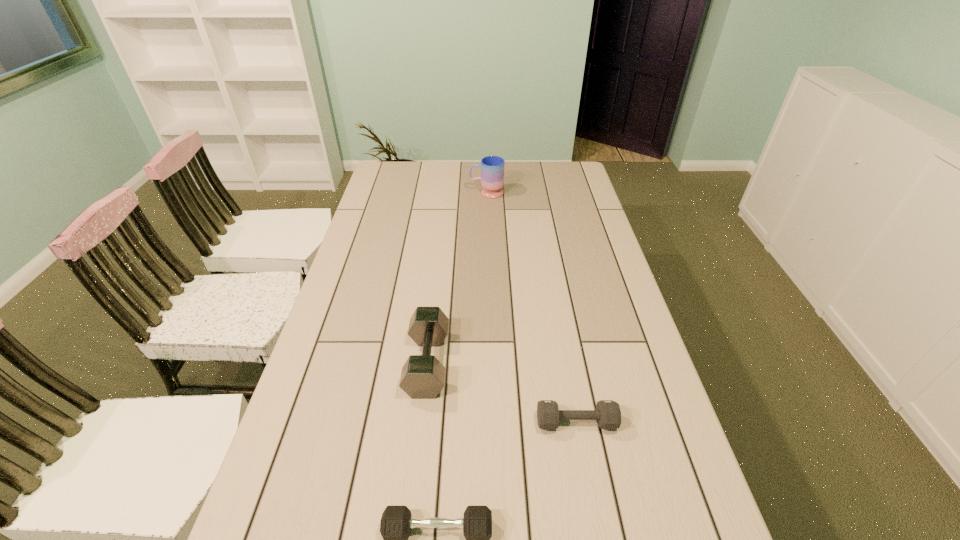
You are a GUI agent. You are given a task and a screenshot of the screen. Output one action in this format:
    pyautogui.click(x=<x>, y=<y>)
    Task: Click on the vacant region located 0.340m on the left of the second nearest dumbbell
    This screenshot has width=960, height=540.
    Given the screenshot: What is the action you would take?
    pyautogui.click(x=392, y=422)

Where is `object that is at the far edge`? object that is at the far edge is located at coordinates (492, 167).

Image resolution: width=960 pixels, height=540 pixels. In order to click on object that is at the right edge in this screenshot , I will do `click(608, 414)`.

Where is `vacant region at the far edge of the desktop`? The image size is (960, 540). vacant region at the far edge of the desktop is located at coordinates (421, 179).

Locate an element on the screen. Image resolution: width=960 pixels, height=540 pixels. free region at the left edge of the desktop is located at coordinates (403, 214).

Locate an element on the screen. This screenshot has height=540, width=960. vacant space at the right edge is located at coordinates (619, 350).

Locate an element on the screen. The image size is (960, 540). vacant space at the far left corner of the desktop is located at coordinates (387, 177).

In the image, there is a desktop. In order to click on free space at the far right corner in this screenshot , I will do pos(557,184).

Find the location of a particular element. vacant space that is in between the second nearest dumbbell and the second tallest object is located at coordinates (502, 393).

This screenshot has width=960, height=540. What are the coordinates of `unoccupied position between the mug and the rightmost dumbbell` in the screenshot? It's located at (531, 307).